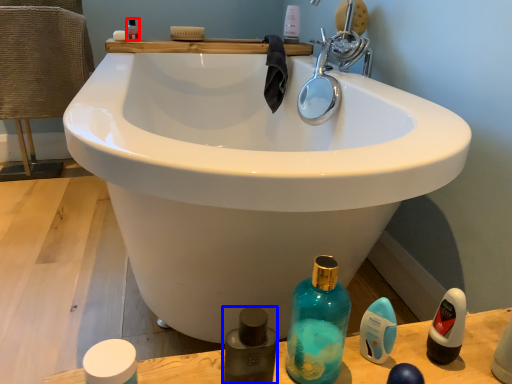
Question: Which object is closer to the camera taking this photo, mouthwash (highlighted by a red box) or cleaning product (highlighted by a blue box)?

Choices:
 (A) mouthwash
 (B) cleaning product

Answer: (B)